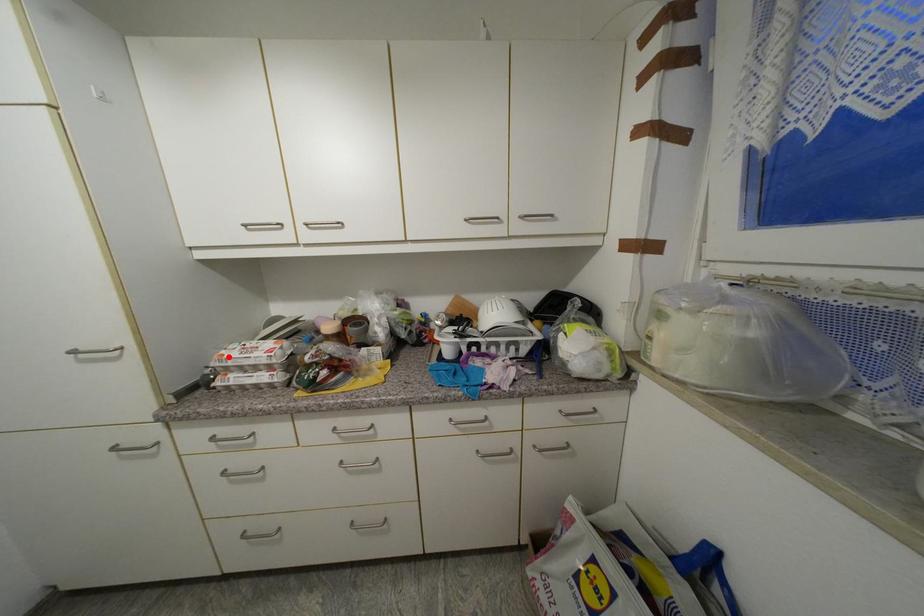
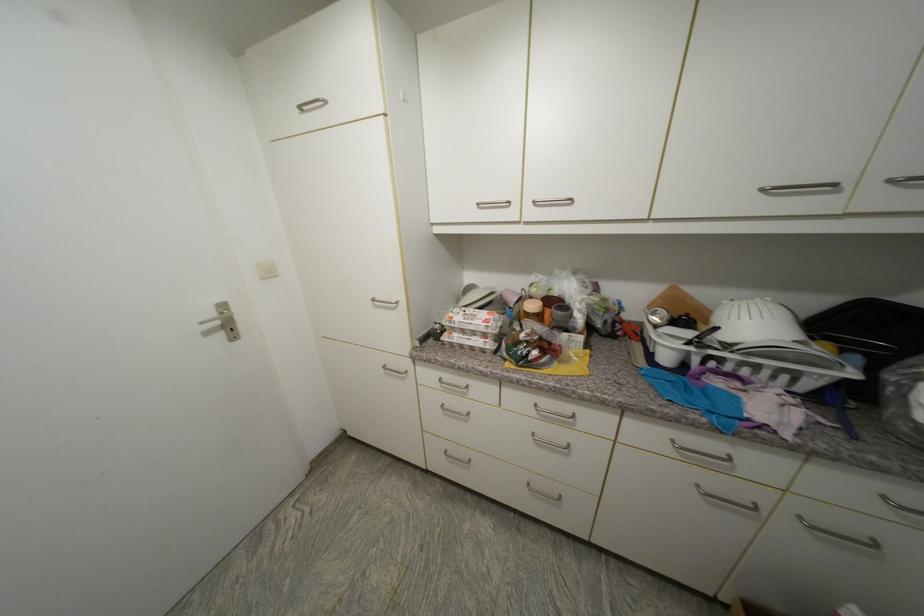
Find the pixel in the second image that matches the highlighted location in the first image.

(457, 318)